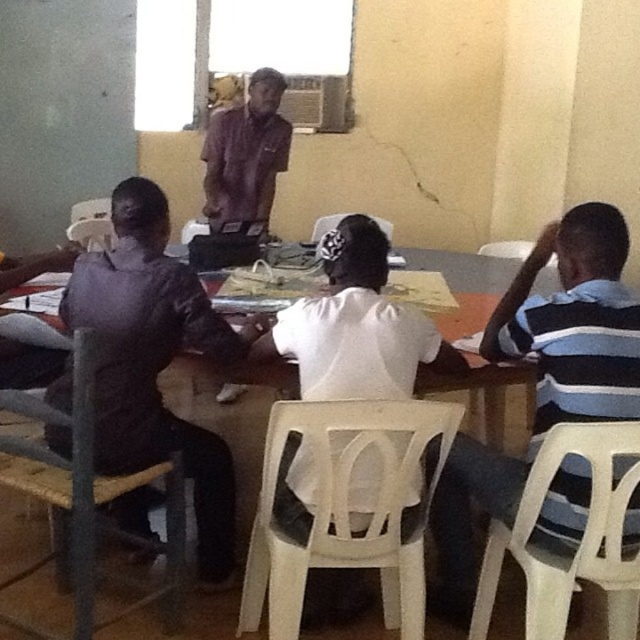
You are standing in the classroom and want to pick up two items located at point (605, 365) and point (138, 419). Which point is closer to you?

Point (605, 365) is closer to the camera than point (138, 419), so you should pick up the item at point (605, 365) first as it is nearer to you.

In the scene shown: You are a teacher standing at the front of the classroom. You want to hand out a worksheet to the student wearing the matte black shirt at left and the student wearing the brown fabric shirt at center. If your arm can reach 1.5 meters, can you reach both students without moving from your position?

The matte black shirt at left is 1.75 meters away from the brown fabric shirt at center, so the distance between them is greater than your arm reach of 1.5 meters. Therefore, you cannot reach both students simultaneously without moving.

You are a teacher observing the classroom. You notice the blue striped shirt at right and the brown fabric shirt at center. Which child is sitting closer to the floor?

The blue striped shirt at right is below brown fabric shirt at center, so the child wearing the blue striped shirt at right is sitting closer to the floor.